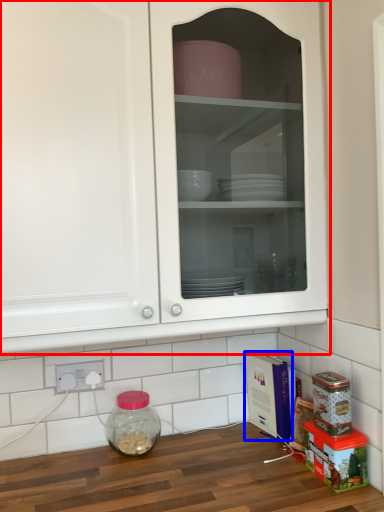
Question: Which object appears closest to the camera in this image, cabinetry (highlighted by a red box) or cardboard box (highlighted by a blue box)?

Choices:
 (A) cabinetry
 (B) cardboard box

Answer: (A)